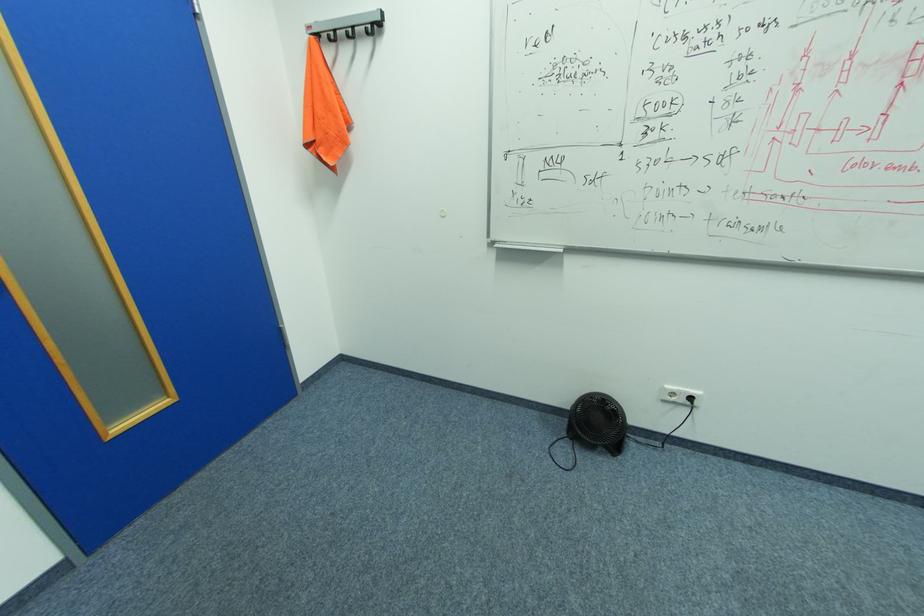
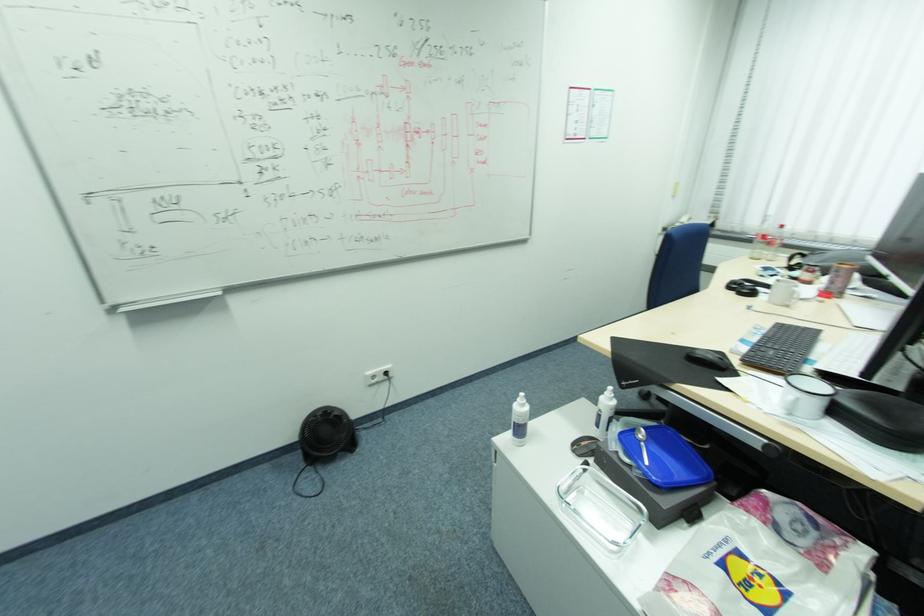
Question: How did the camera likely rotate?

Choices:
 (A) Left
 (B) Right
 (C) Up
 (D) Down

Answer: (B)